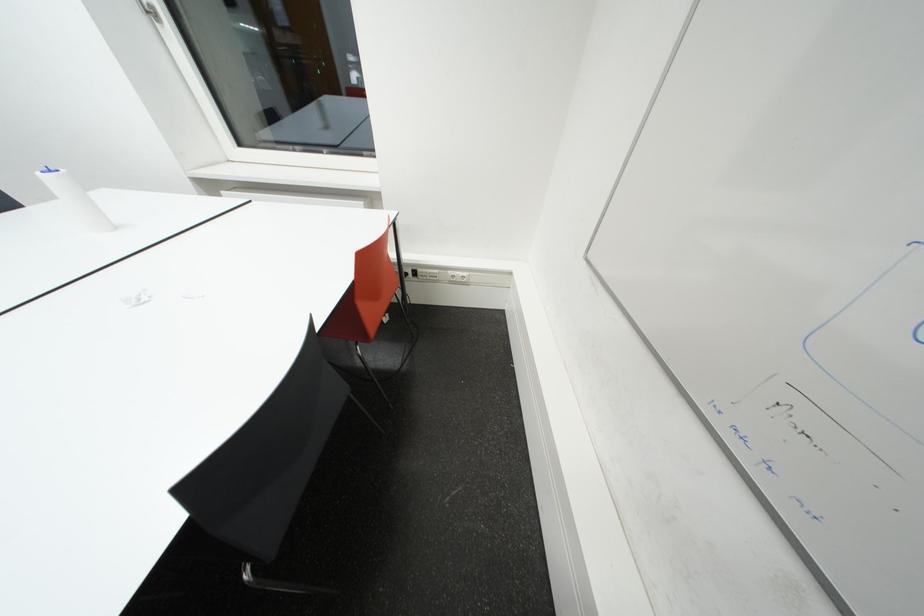
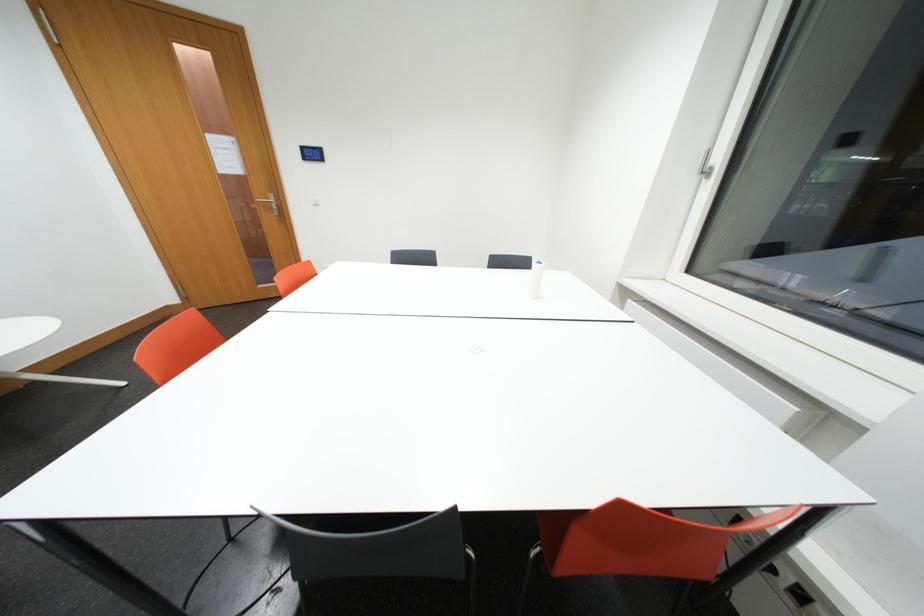
Question: Based on the continuous images, in which direction is the camera rotating? Reply with the corresponding letter.

Choices:
 (A) Left
 (B) Right
 (C) Up
 (D) Down

Answer: (A)